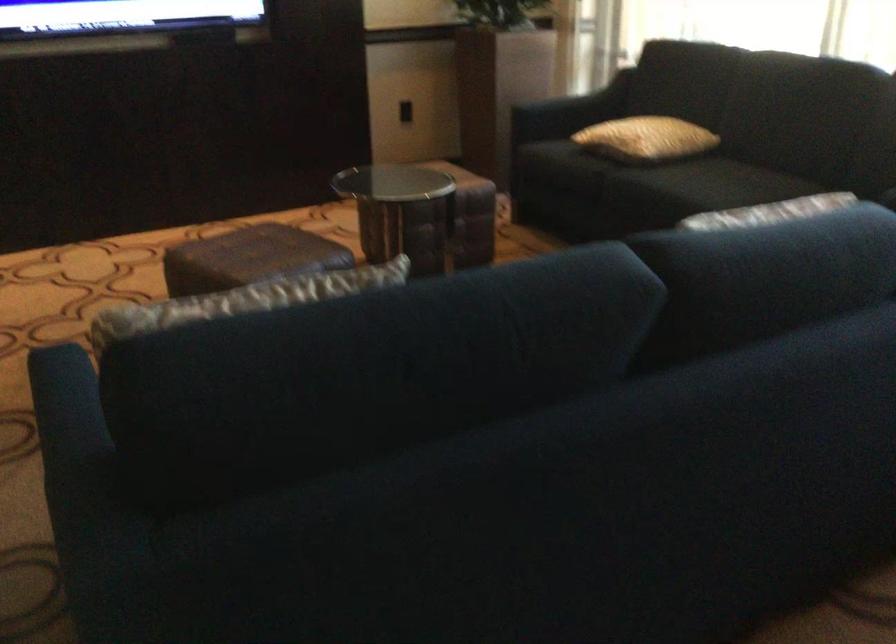
Identify the location of dark sofa armrest. (586, 99).